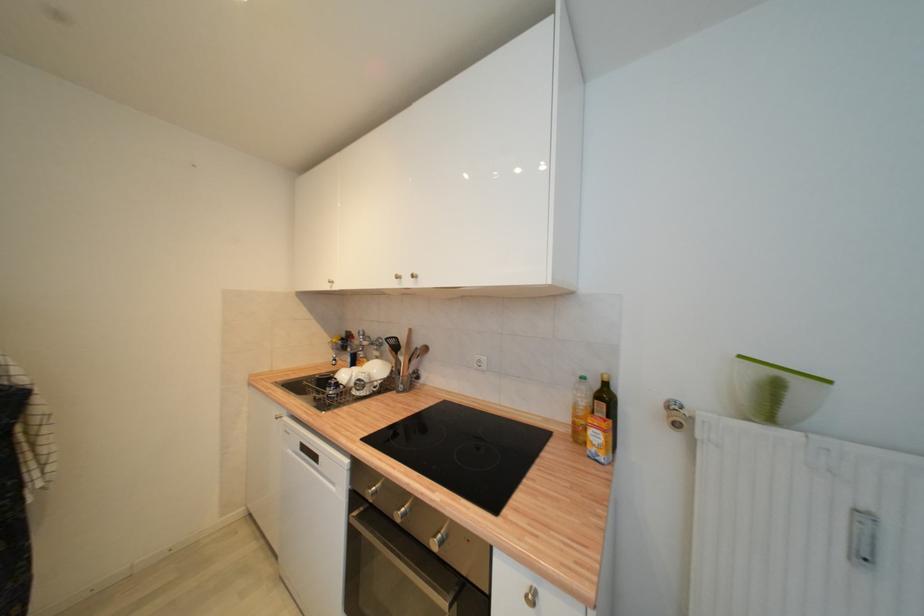
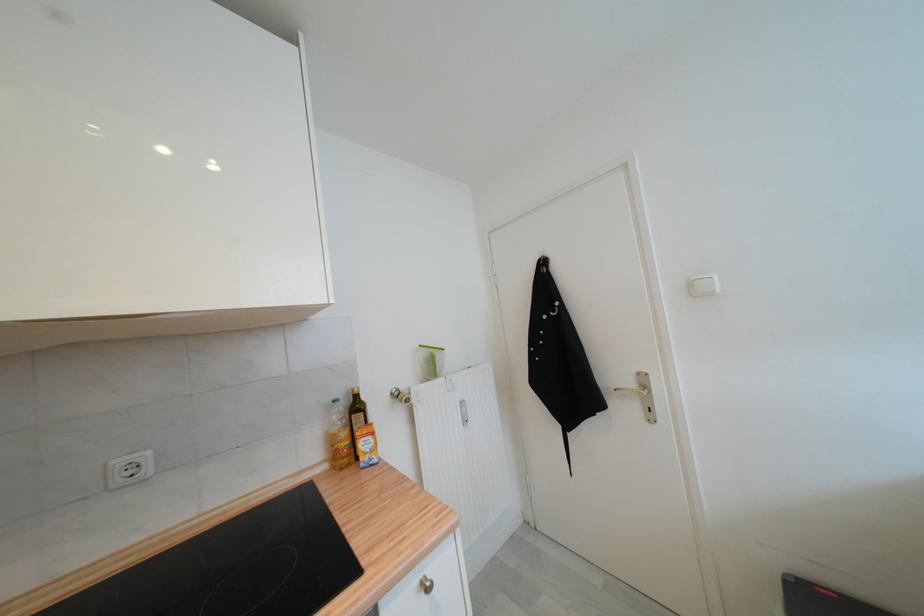
In the second image, find the point that corresponds to [586,379] in the first image.

(339, 403)